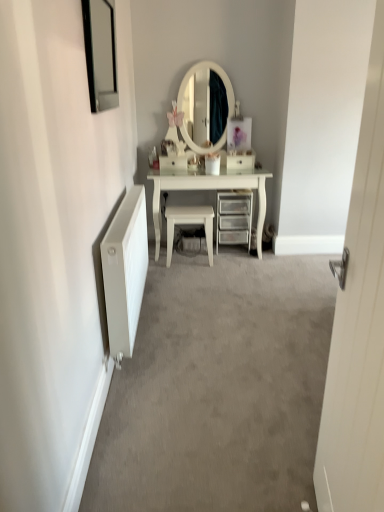
Find the location of `free space above white glossy drawer at center (from a real-world perspective)`. free space above white glossy drawer at center (from a real-world perspective) is located at coordinates (238, 153).